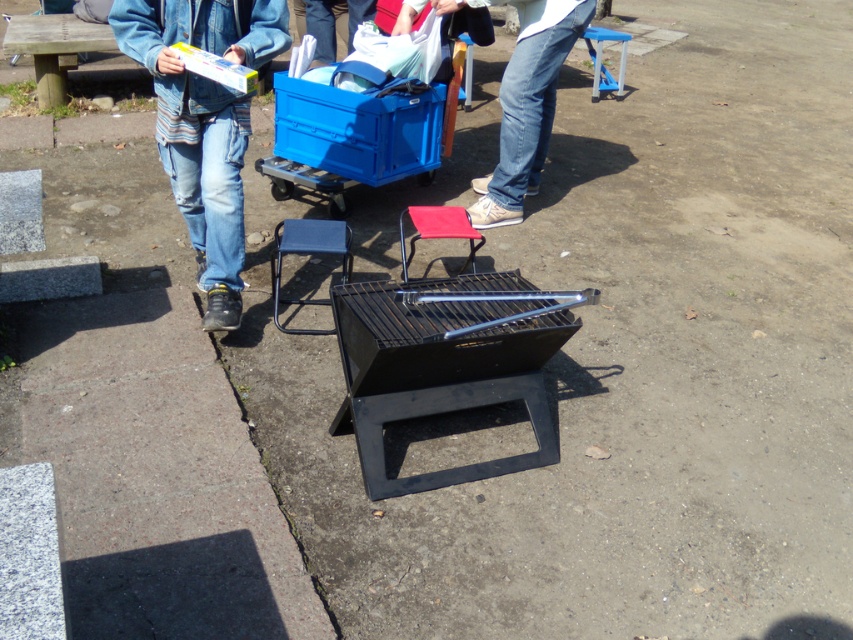
Who is positioned more to the left, denim jeans at left or blue metal stool at center?

denim jeans at left is more to the left.

Is denim jeans at left wider than blue metal stool at center?

Correct, the width of denim jeans at left exceeds that of blue metal stool at center.

Locate an element on the screen. This screenshot has width=853, height=640. denim jeans at left is located at coordinates (204, 122).

Find the location of a particular element. denim jeans at left is located at coordinates (204, 122).

Can you confirm if jeans at center is positioned above red fabric stool at center?

Yes.

Does point (526, 144) come closer to viewer compared to point (399, 225)?

No.

Identify the location of jeans at center. (527, 106).

Does blue metal stool at center appear on the left side of red fabric stool at center?

Yes, blue metal stool at center is to the left of red fabric stool at center.

Is blue metal stool at center behind red fabric stool at center?

No.

Which is in front, point (309, 228) or point (469, 248)?

Point (309, 228) is in front.

You are a GUI agent. You are given a task and a screenshot of the screen. Output one action in this format:
    pyautogui.click(x=<x>, y=<y>)
    Task: Click on the blue metal stool at center
    
    Given the screenshot: What is the action you would take?
    pyautogui.click(x=310, y=253)